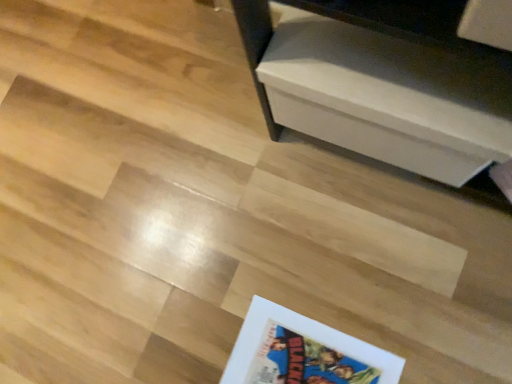
Find the location of `empty space that is ontop of white fabric ottoman at upper right (from a real-world perspective)`. empty space that is ontop of white fabric ottoman at upper right (from a real-world perspective) is located at coordinates (393, 66).